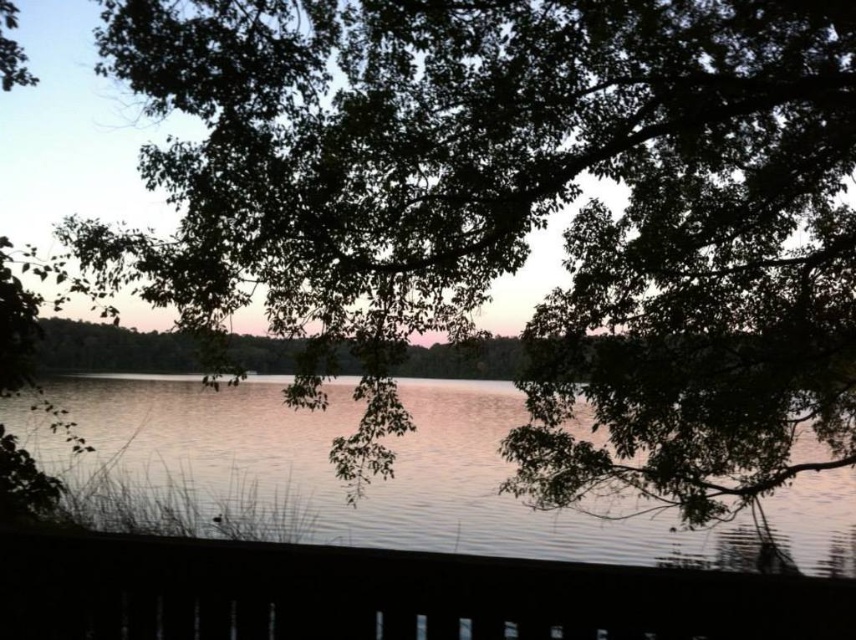
Question: Does smooth wooden deck at lower center come behind silvery reflective water at center?

Choices:
 (A) yes
 (B) no

Answer: (B)

Question: Is smooth wooden deck at lower center to the left of silvery reflective water at center from the viewer's perspective?

Choices:
 (A) yes
 (B) no

Answer: (A)

Question: Observing the image, what is the correct spatial positioning of smooth wooden deck at lower center in reference to silvery reflective water at center?

Choices:
 (A) right
 (B) left

Answer: (B)

Question: Which point is farther to the camera?

Choices:
 (A) (407, 637)
 (B) (260, 381)

Answer: (B)

Question: Which of the following is the farthest from the observer?

Choices:
 (A) (676, 630)
 (B) (598, 560)

Answer: (B)